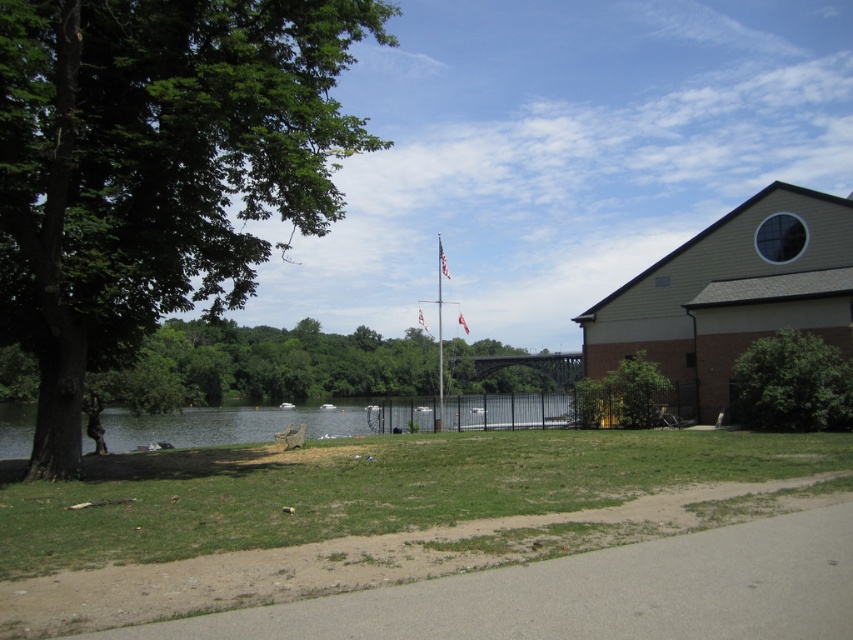
Which is more to the right, green leafy tree at left or metallic flag pole at center?

Positioned to the right is metallic flag pole at center.

Based on the photo, who is more forward, (33, 323) or (440, 417)?

Positioned in front is point (33, 323).

Between point (207, 42) and point (440, 333), which one is positioned behind?

The point (440, 333) is more distant.

Find the location of a particular element. This screenshot has height=640, width=853. green leafy tree at left is located at coordinates (155, 168).

Does point (802, 401) lie in front of point (467, 326)?

Yes, point (802, 401) is closer to viewer.

Is green leafy tree at right closer to camera compared to red fabric flag at center?

Yes, green leafy tree at right is closer to the viewer.

Measure the distance between green leafy tree at right and camera.

green leafy tree at right is 22.86 meters from camera.

In order to click on green leafy tree at right in this screenshot , I will do `click(791, 385)`.

Who is positioned more to the right, green leafy tree at left or green leafy tree at right?

From the viewer's perspective, green leafy tree at right appears more on the right side.

Measure the distance from green leafy tree at left to green leafy tree at right.

They are 16.02 meters apart.

Describe the element at coordinates (155, 168) in the screenshot. I see `green leafy tree at left` at that location.

Locate an element on the screen. green leafy tree at left is located at coordinates (155, 168).